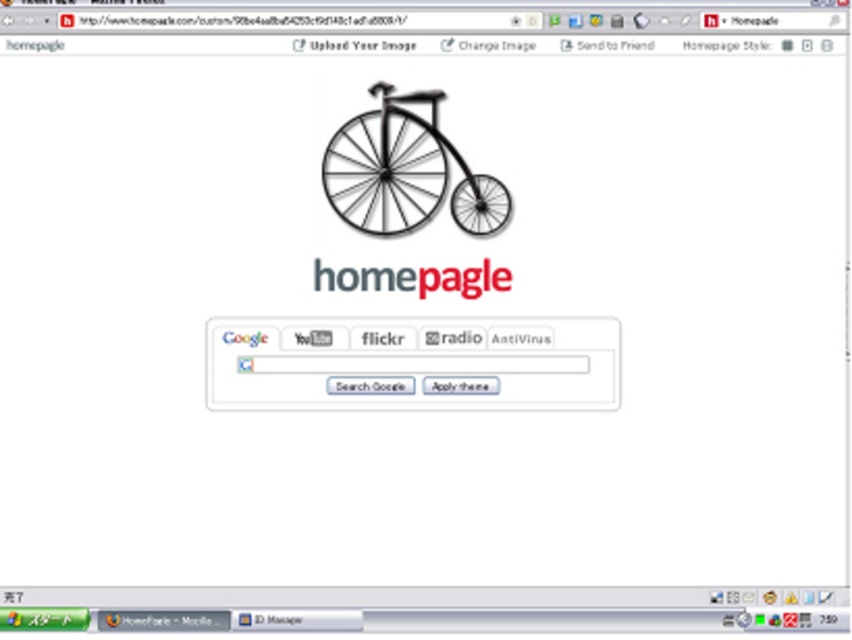
You are a graphic designer working on a website layout. You need to place a new button exactly at the center of the screen. However, there is already a red matte homepage at center located at point (413,278). Will placing the button at the center interfere with the red matte homepage at center?

The red matte homepage at center is already located at the center point (413,278), so placing the button at the center would directly overlap with the red matte homepage at center, causing interference.

You are designing a webpage layout and need to place a navigation bar that will occupy the space where the black matte bicycle at center is located. According to the coordinates provided, where exactly should you position the navigation bar?

The black matte bicycle at center is located at coordinates point [404,172], so the navigation bar should be positioned there.